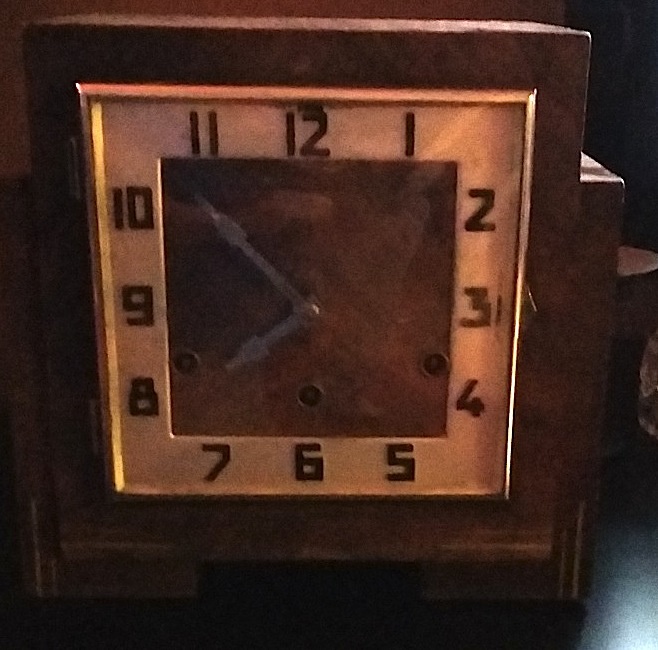
This screenshot has height=650, width=658. Identify the location of clock face. (458, 457), (141, 461), (130, 140), (501, 136).